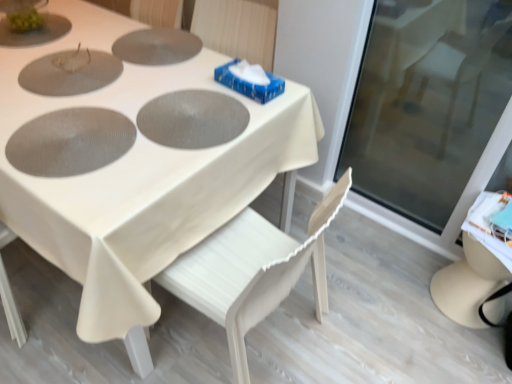
Where is `vacant region to the left of transparent glass door at right`? The image size is (512, 384). vacant region to the left of transparent glass door at right is located at coordinates (357, 239).